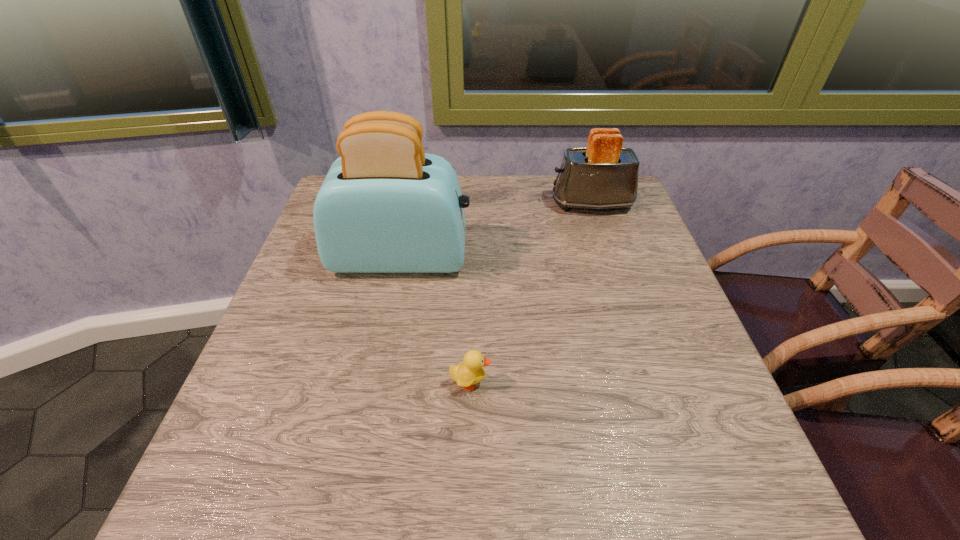
Identify the location of the nearer toaster. The width and height of the screenshot is (960, 540). (385, 206).

At what (x,y) coordinates should I click in order to perform the action: click on the second farthest object. Please return your answer as a coordinate pair (x, y). Looking at the image, I should click on (385, 206).

Where is `the farther toaster`? the farther toaster is located at coordinates (604, 175).

This screenshot has width=960, height=540. What are the coordinates of `the rightmost object` in the screenshot? It's located at point(604,175).

Find the location of a particular element. This screenshot has height=540, width=960. the shortest object is located at coordinates (471, 372).

Find the location of a particular element. duckling is located at coordinates (471, 372).

This screenshot has height=540, width=960. In order to click on free space located on the side of the second nearest object with the lever in this screenshot , I will do `click(604, 258)`.

You are a GUI agent. You are given a task and a screenshot of the screen. Output one action in this format:
    pyautogui.click(x=<x>, y=<y>)
    Task: Click on the free region located 0.150m on the side of the rightmost object with the control lever
    
    Given the screenshot: What is the action you would take?
    pyautogui.click(x=494, y=204)

Image resolution: width=960 pixels, height=540 pixels. In order to click on free space located on the side of the rightmost object with the control lever in this screenshot , I will do `click(446, 204)`.

Find the location of a particular element. The image size is (960, 540). vacant position located 0.380m on the side of the rightmost object with the control lever is located at coordinates (409, 204).